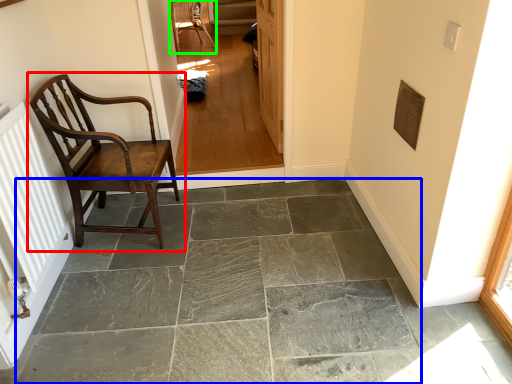
Question: Which object is the closest to the chair (highlighted by a red box)? Choose among these: concrete (highlighted by a blue box) or chair (highlighted by a green box).

Choices:
 (A) concrete
 (B) chair

Answer: (A)